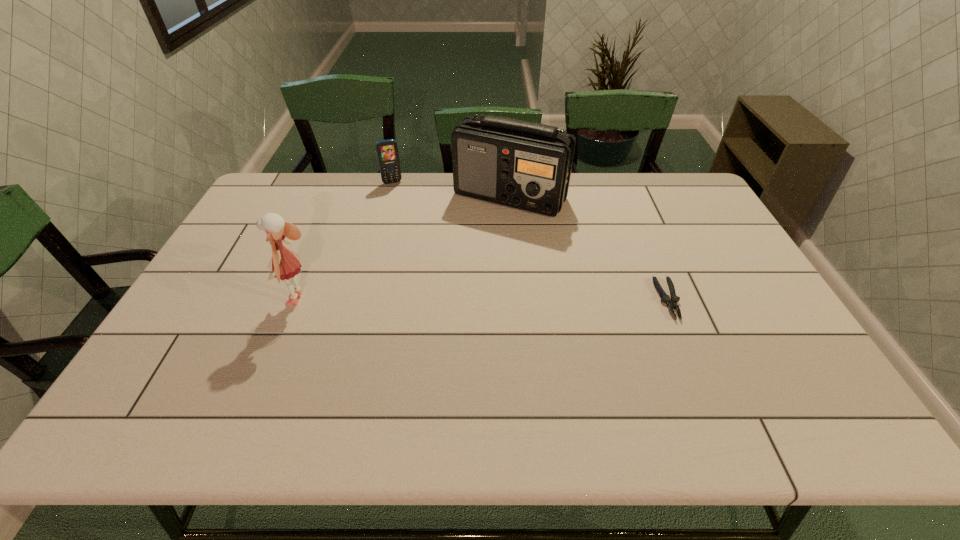
In the image, there is a desktop. At what (x,y) coordinates should I click in order to perform the action: click on blank space at the left edge. Please return your answer as a coordinate pair (x, y). Looking at the image, I should click on (235, 293).

This screenshot has width=960, height=540. In order to click on vacant space at the right edge of the desktop in this screenshot , I will do `click(725, 240)`.

You are a GUI agent. You are given a task and a screenshot of the screen. Output one action in this format:
    pyautogui.click(x=<x>, y=<y>)
    Task: Click on the vacant space at the far left corner of the desktop
    This screenshot has height=540, width=960.
    Given the screenshot: What is the action you would take?
    pyautogui.click(x=295, y=184)

The height and width of the screenshot is (540, 960). What are the coordinates of `vacant space at the far right corner of the desktop` in the screenshot? It's located at coord(704,208).

Where is `free space between the cellular telephone and the rightmost object`? This screenshot has width=960, height=540. free space between the cellular telephone and the rightmost object is located at coordinates (530, 241).

Where is `blank region between the pliers and the third object from right to left`? blank region between the pliers and the third object from right to left is located at coordinates coord(530,241).

Image resolution: width=960 pixels, height=540 pixels. Find the location of `empty location between the second object from right to left and the shortest object`. empty location between the second object from right to left and the shortest object is located at coordinates (589, 248).

Find the location of a particular element. The width and height of the screenshot is (960, 540). empty space between the cellular telephone and the radio receiver is located at coordinates (451, 190).

Locate an element on the screen. This screenshot has width=960, height=540. blank region between the pliers and the cellular telephone is located at coordinates (530, 241).

Identify the location of unoccupied area between the leftmost object and the radio receiver. (405, 248).